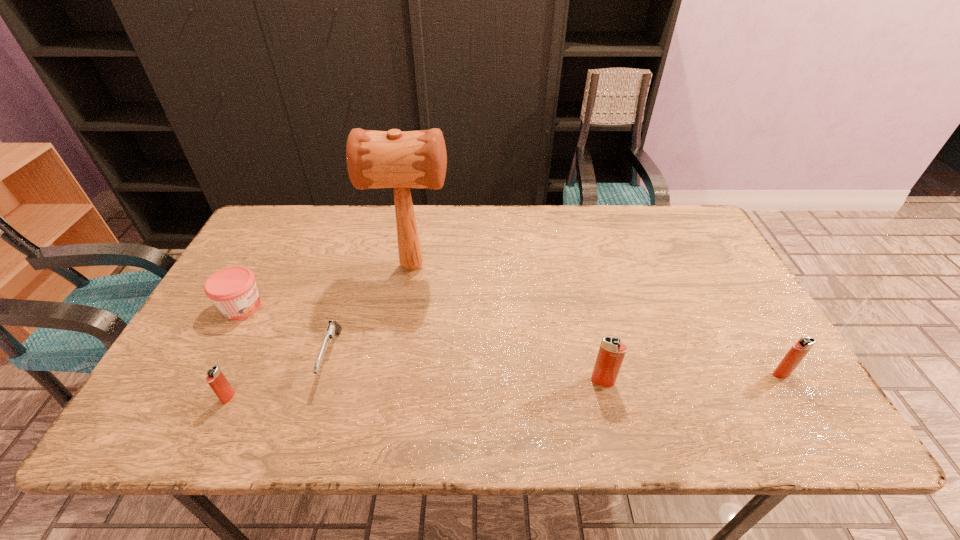
Locate an element on the screen. This screenshot has width=960, height=540. jam present at the left edge is located at coordinates (233, 290).

Locate an element on the screen. object at the right edge is located at coordinates (799, 350).

I want to click on object located in the near left corner section of the desktop, so click(217, 381).

Locate an element on the screen. The image size is (960, 540). object that is positioned at the near right corner is located at coordinates (799, 350).

This screenshot has width=960, height=540. What are the coordinates of `free spot at the far edge of the desktop` in the screenshot? It's located at (527, 207).

This screenshot has height=540, width=960. In order to click on free space at the near edge of the desktop in this screenshot , I will do `click(523, 395)`.

This screenshot has width=960, height=540. I want to click on free space at the left edge of the desktop, so click(241, 262).

Locate an element on the screen. Image resolution: width=960 pixels, height=540 pixels. vacant area at the right edge is located at coordinates (701, 326).

Image resolution: width=960 pixels, height=540 pixels. In the image, there is a desktop. Identify the location of vacant space at the far left corner. (265, 222).

Identify the location of unoccupied position between the third tallest object and the leftmost object. Image resolution: width=960 pixels, height=540 pixels. (512, 340).